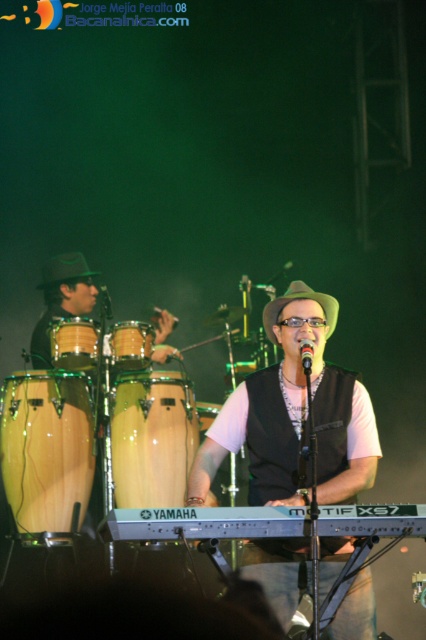
Question: Can you confirm if natural wood conga at center is thinner than metallic silver microphone at center?

Choices:
 (A) no
 (B) yes

Answer: (A)

Question: Estimate the real-world distances between objects in this image. Which object is closer to the black matte microphone at center?

Choices:
 (A) metallic silver microphone at center
 (B) light brown wood conga at center

Answer: (B)

Question: Which point is farther to the camera?

Choices:
 (A) (80, 275)
 (B) (307, 285)
 (C) (60, 356)
 (D) (307, 320)

Answer: (A)

Question: Is wooden conga drum at left closer to camera compared to green felt hat at left?

Choices:
 (A) yes
 (B) no

Answer: (A)

Question: Is matte black vest at center below natural wood conga at center?

Choices:
 (A) yes
 (B) no

Answer: (B)

Question: Which point is closer to the camera taking this photo?

Choices:
 (A) (127, 323)
 (B) (299, 349)
 (C) (175, 320)

Answer: (B)